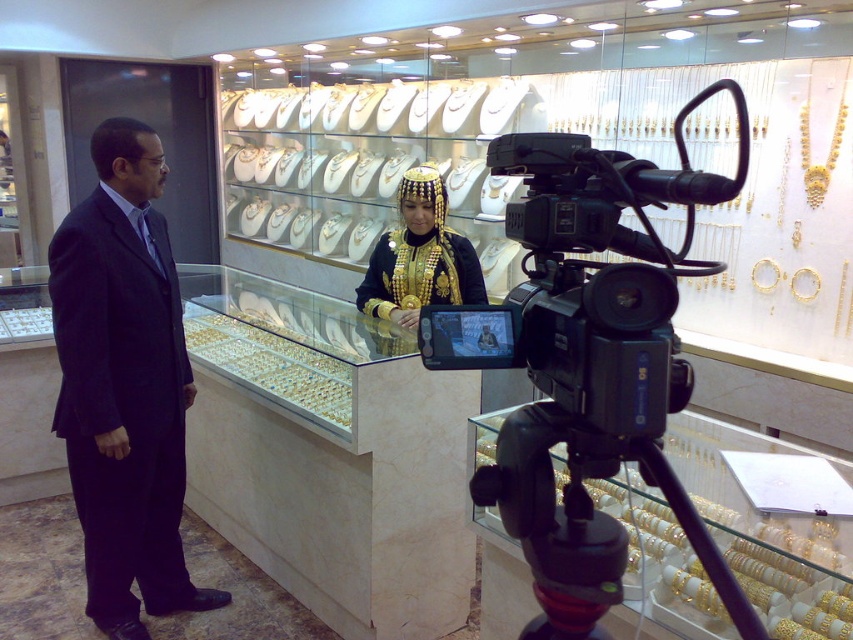
You are a camera operator trying to adjust the camera angle. Since the black plastic video camera at center and the black plastic tripod at lower center are both in your view, which one is closer to you?

The black plastic video camera at center is closer to you because it is in front of the black plastic tripod at lower center.

You are a camera operator in a jewelry store. You need to focus on two points in the scene. The first point is at coordinates point (573, 292) and the second point is at coordinates point (531, 520). Which point is closer to the camera?

Point (573, 292) is closer to the camera than point (531, 520).